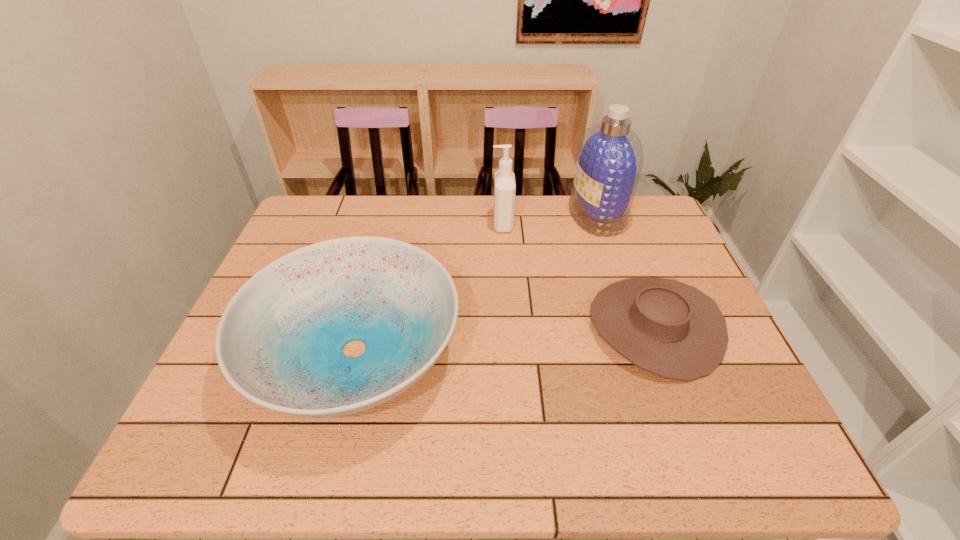
You are a GUI agent. You are given a task and a screenshot of the screen. Output one action in this format:
    pyautogui.click(x=<x>, y=<y>)
    Task: Click on the free space at the near edge of the desktop
    This screenshot has width=960, height=540.
    Given the screenshot: What is the action you would take?
    (553, 435)

This screenshot has height=540, width=960. I want to click on blank space at the right edge of the desktop, so click(631, 254).

In the image, there is a desktop. At what (x,y) coordinates should I click in order to perform the action: click on free space at the near left corner. Please return your answer as a coordinate pair (x, y). This screenshot has height=540, width=960. Looking at the image, I should click on (248, 463).

Image resolution: width=960 pixels, height=540 pixels. What are the coordinates of `free spot at the far right corner of the desktop` in the screenshot? It's located at (655, 199).

Locate an element on the screen. The image size is (960, 540). empty space between the cowboy hat and the second object from left to right is located at coordinates (579, 275).

Where is `free space between the tallest object and the third tallest object`? free space between the tallest object and the third tallest object is located at coordinates (475, 283).

This screenshot has width=960, height=540. What are the coordinates of `free space between the shortest object and the tallest object` in the screenshot? It's located at (626, 272).

Locate an element on the screen. The image size is (960, 540). unoccupied area between the shortest object and the second tallest object is located at coordinates (579, 275).

Where is `vacant point located between the dish and the shortest object`? vacant point located between the dish and the shortest object is located at coordinates (505, 339).

What are the coordinates of `free space between the third shortest object and the taller cleansing agent` in the screenshot? It's located at (549, 220).